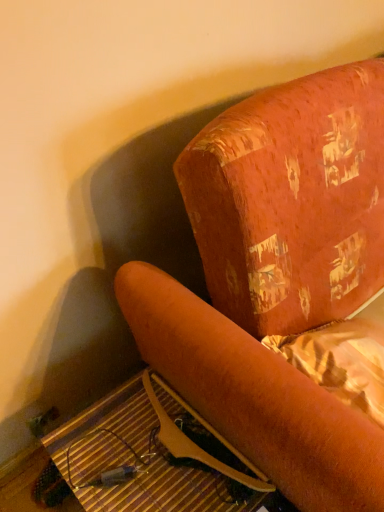
Question: From a real-world perspective, is wooden at lower left on top of velvet orange armchair at center?

Choices:
 (A) yes
 (B) no

Answer: (B)

Question: Considering the relative sizes of wooden at lower left and velvet orange armchair at center in the image provided, is wooden at lower left thinner than velvet orange armchair at center?

Choices:
 (A) no
 (B) yes

Answer: (B)

Question: Does wooden at lower left have a lesser height compared to velvet orange armchair at center?

Choices:
 (A) yes
 (B) no

Answer: (A)

Question: Would you say wooden at lower left is outside velvet orange armchair at center?

Choices:
 (A) yes
 (B) no

Answer: (A)

Question: From a real-world perspective, is wooden at lower left beneath velvet orange armchair at center?

Choices:
 (A) yes
 (B) no

Answer: (A)

Question: Considering the relative positions of wooden at lower left and velvet orange armchair at center in the image provided, is wooden at lower left to the right of velvet orange armchair at center from the viewer's perspective?

Choices:
 (A) yes
 (B) no

Answer: (B)

Question: Is wooden at lower left surrounded by velvet orange armchair at center?

Choices:
 (A) yes
 (B) no

Answer: (B)

Question: Would you say velvet orange armchair at center is outside wooden at lower left?

Choices:
 (A) yes
 (B) no

Answer: (A)

Question: Can you confirm if velvet orange armchair at center is positioned to the left of wooden at lower left?

Choices:
 (A) no
 (B) yes

Answer: (A)

Question: Does velvet orange armchair at center have a lesser width compared to wooden at lower left?

Choices:
 (A) yes
 (B) no

Answer: (B)

Question: From a real-world perspective, is velvet orange armchair at center physically below wooden at lower left?

Choices:
 (A) no
 (B) yes

Answer: (A)

Question: Can you confirm if velvet orange armchair at center is smaller than wooden at lower left?

Choices:
 (A) no
 (B) yes

Answer: (A)

Question: Do you think velvet orange armchair at center is within wooden at lower left, or outside of it?

Choices:
 (A) inside
 (B) outside

Answer: (B)